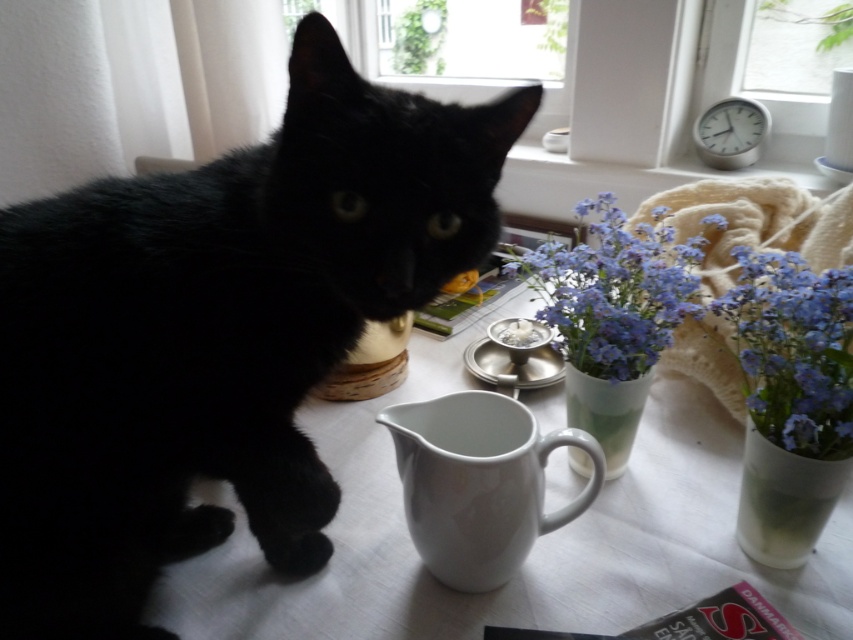
You are arranging flowers in a room and need to place a new vase. You see the matte ceramic vase at upper right and the blue matte vase at center right. Which vase is positioned higher on the table?

The matte ceramic vase at upper right is positioned higher on the table than the blue matte vase at center right.

You are arranging flowers for a party and need to place a bouquet between the white glossy table at center and the matte ceramic vase at upper right. Which side of the table should you place it on to keep it aligned with the existing vase?

The matte ceramic vase at upper right is to the right of the white glossy table at center, so you should place the bouquet to the right side of the white glossy table at center to align with the existing vase.

You are a photographer positioned at the center of the room. You want to capture a closeup of the matte ceramic vase at upper right. Based on its position, which direction should you move your camera to focus on it?

The matte ceramic vase at upper right is located at point 0.498 on the x axis and 0.823 on the y axis. Since the photographer is at the center, moving the camera slightly to the right and upwards would align it with the vase.